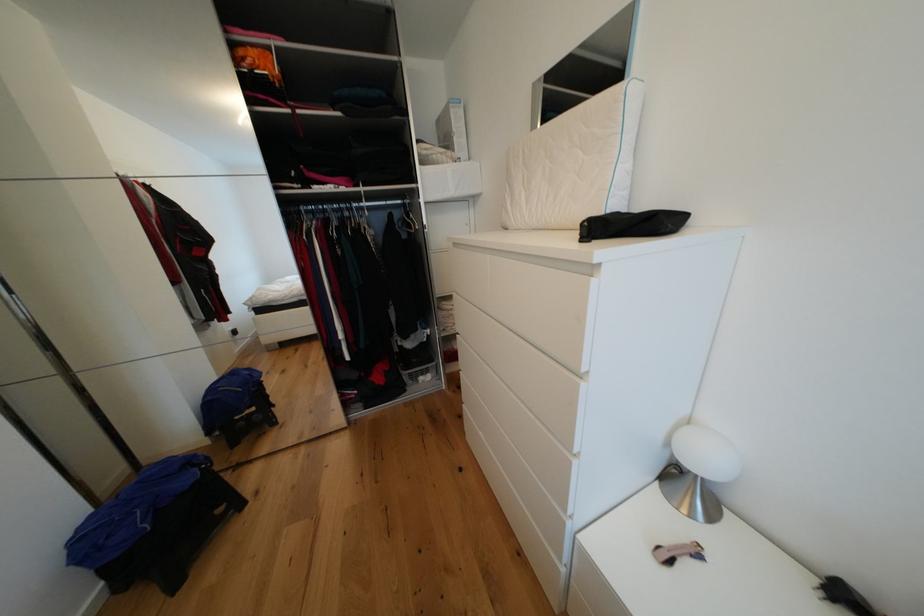
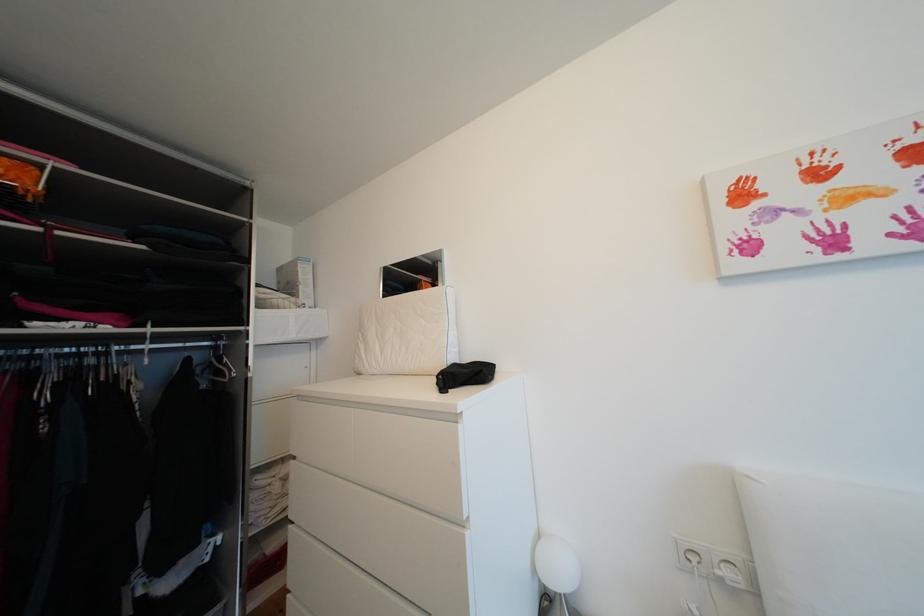
In the second image, find the point that corresponds to (x=514, y=213) in the first image.

(368, 359)